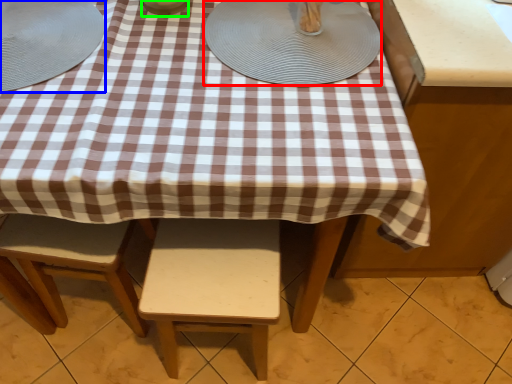
Question: Estimate the real-world distances between objects in this image. Which object is closer to platter (highlighted by a red box), tableware (highlighted by a blue box) or tableware (highlighted by a green box)?

Choices:
 (A) tableware
 (B) tableware

Answer: (B)